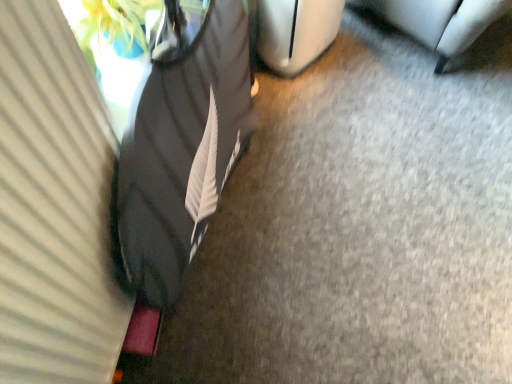
Question: Is metallic silver trash can at lower right oriented away from black fabric bean bag chair at left?

Choices:
 (A) yes
 (B) no

Answer: (B)

Question: Is metallic silver trash can at lower right behind black fabric bean bag chair at left?

Choices:
 (A) no
 (B) yes

Answer: (B)

Question: Is metallic silver trash can at lower right positioned in front of black fabric bean bag chair at left?

Choices:
 (A) yes
 (B) no

Answer: (B)

Question: Is metallic silver trash can at lower right wider than black fabric bean bag chair at left?

Choices:
 (A) no
 (B) yes

Answer: (B)

Question: Can you confirm if metallic silver trash can at lower right is taller than black fabric bean bag chair at left?

Choices:
 (A) no
 (B) yes

Answer: (A)

Question: From the image's perspective, is black fabric bean bag chair at left positioned above or below white matte curtain at left?

Choices:
 (A) below
 (B) above

Answer: (B)

Question: Is point (134, 264) positioned closer to the camera than point (75, 307)?

Choices:
 (A) closer
 (B) farther

Answer: (B)

Question: Is black fabric bean bag chair at left taller or shorter than white matte curtain at left?

Choices:
 (A) tall
 (B) short

Answer: (A)

Question: From a real-world perspective, is black fabric bean bag chair at left above or below white matte curtain at left?

Choices:
 (A) above
 (B) below

Answer: (B)

Question: Is metallic silver trash can at lower right wider or thinner than white matte curtain at left?

Choices:
 (A) wide
 (B) thin

Answer: (A)

Question: In terms of height, does metallic silver trash can at lower right look taller or shorter compared to white matte curtain at left?

Choices:
 (A) short
 (B) tall

Answer: (A)

Question: Is metallic silver trash can at lower right situated inside white matte curtain at left or outside?

Choices:
 (A) outside
 (B) inside

Answer: (A)

Question: Is point (362, 1) closer or farther from the camera than point (114, 334)?

Choices:
 (A) closer
 (B) farther

Answer: (B)

Question: Visually, is black fabric bean bag chair at left positioned to the left or to the right of metallic silver trash can at lower right?

Choices:
 (A) left
 (B) right

Answer: (A)

Question: Considering the positions of black fabric bean bag chair at left and metallic silver trash can at lower right in the image, is black fabric bean bag chair at left wider or thinner than metallic silver trash can at lower right?

Choices:
 (A) thin
 (B) wide

Answer: (A)